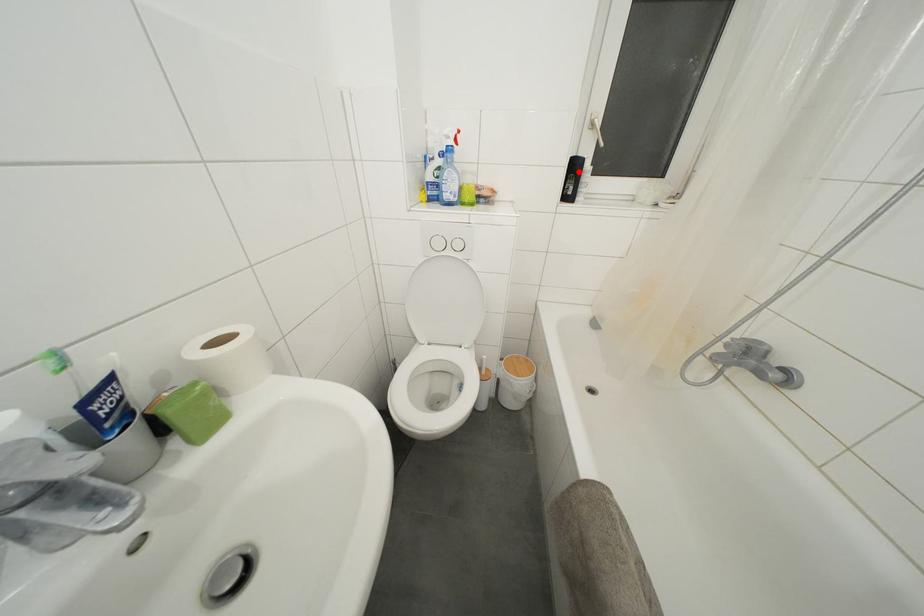
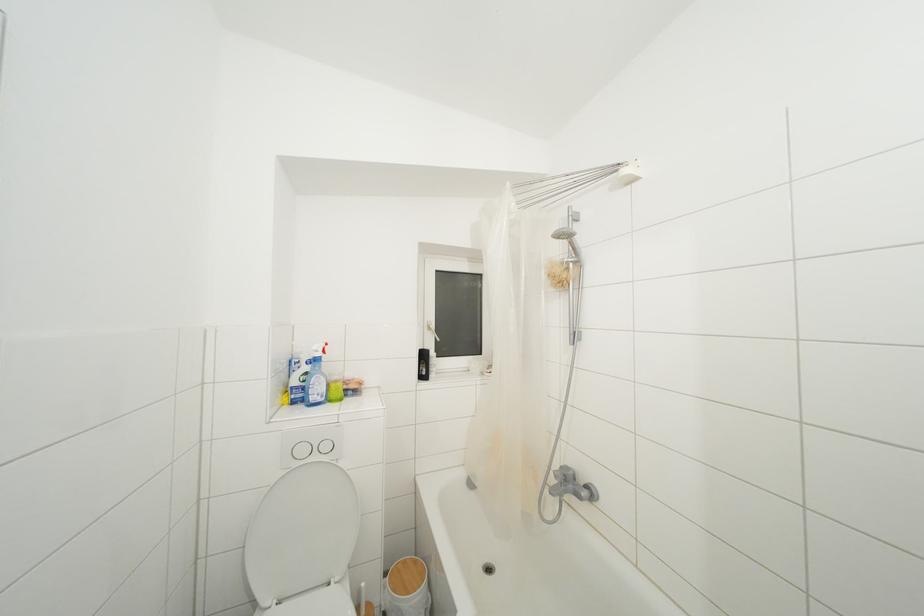
The point at the highlighted location is marked in the first image. Where is the corresponding point in the second image?

(428, 361)